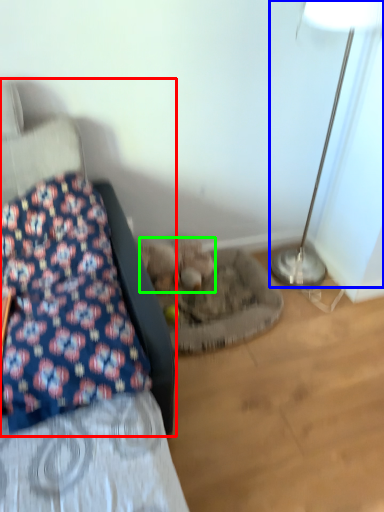
Question: Based on their relative distances, which object is farther from furniture (highlighted by a red box)? Choose from lamp (highlighted by a blue box) and animal (highlighted by a green box).

Choices:
 (A) lamp
 (B) animal

Answer: (A)